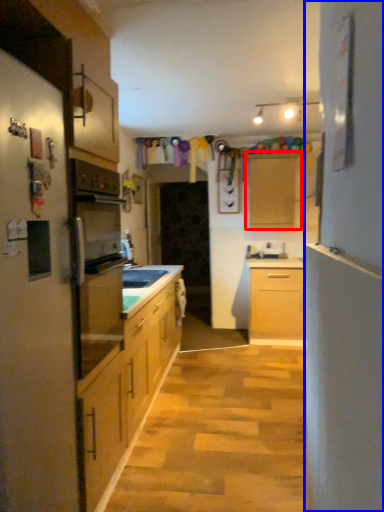
Question: Which point is further to the camera, cabinetry (highlighted by a red box) or side (highlighted by a blue box)?

Choices:
 (A) cabinetry
 (B) side

Answer: (A)